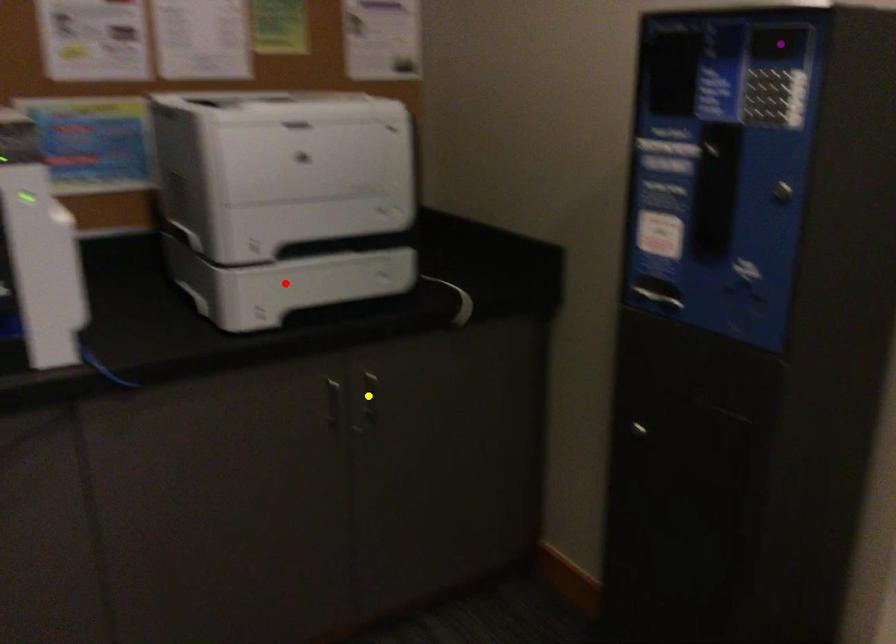
Order these from nearest to farthest:
A) red point
B) purple point
C) yellow point

yellow point, red point, purple point